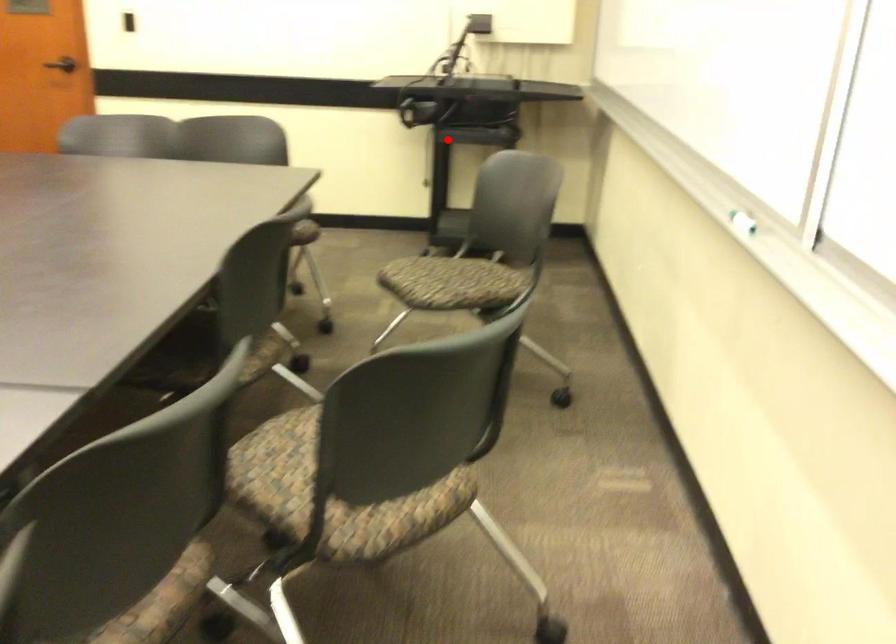
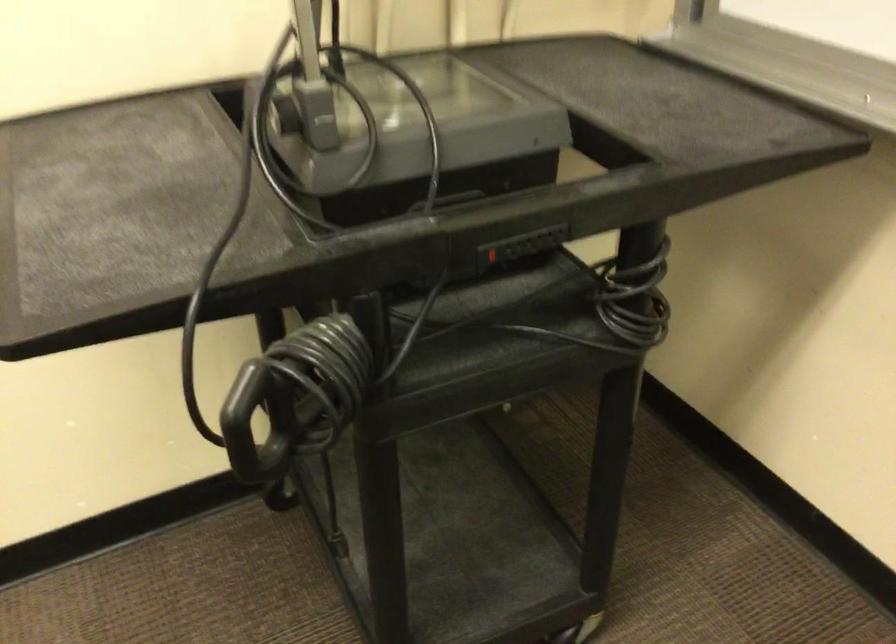
Question: I am providing you with two images of the same scene from different viewpoints. Given a red point in image1, look at the same physical point in image2. Is it:

Choices:
 (A) Closer to the viewpoint
 (B) Farther from the viewpoint

Answer: (A)